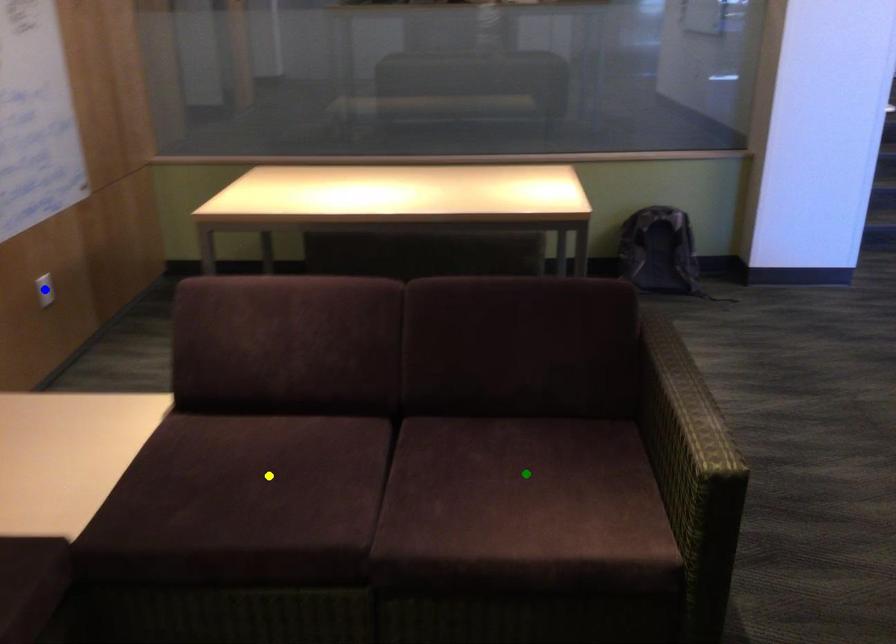
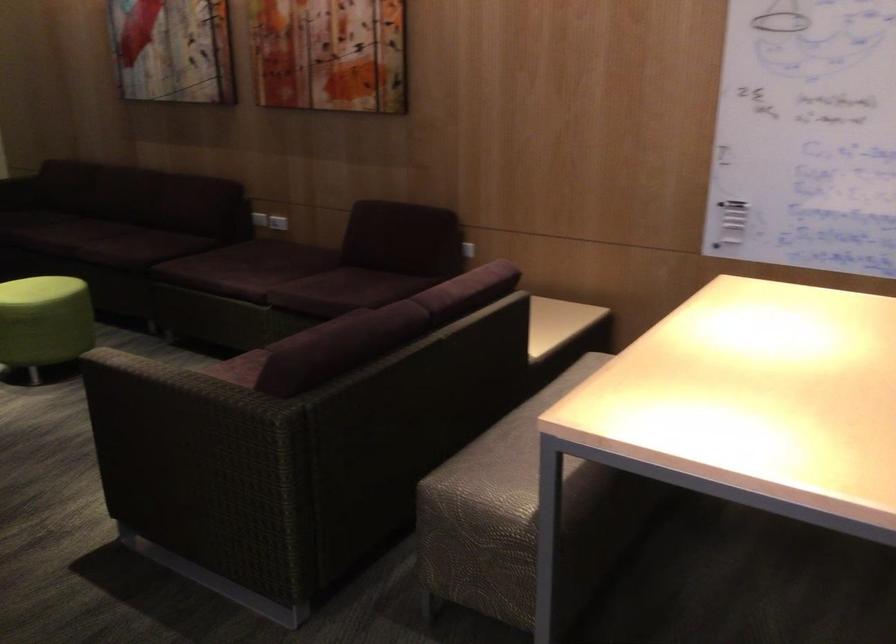
I am providing you with two images of the same scene from different viewpoints. Three points are marked in image1. Which point corresponds to a part or object that is occluded in image2?In image1, three points are marked. Which of them correspond to a part or object that is occluded in image2?Among the three points shown in image1, which one corresponds to a part or object that is no longer visible due to occlusion in image2?

Invisible in image2: green point, yellow point, blue point.